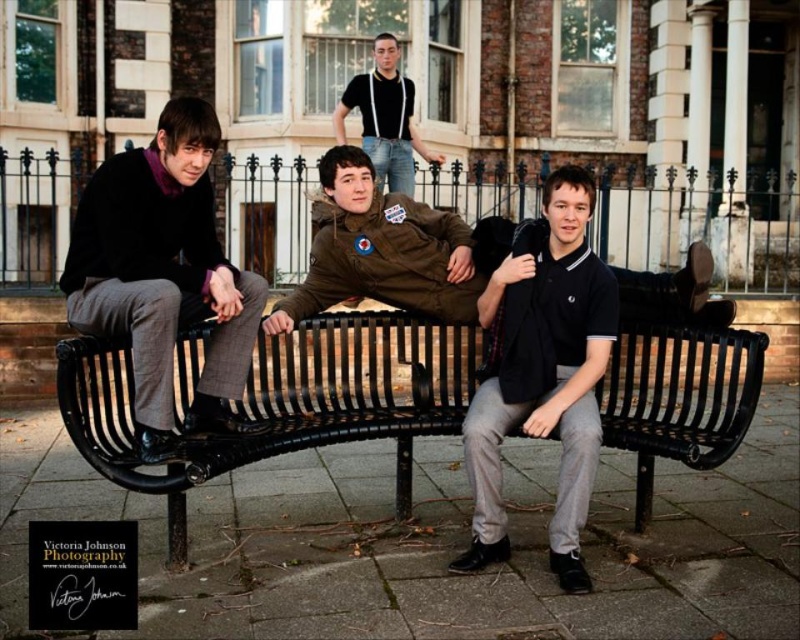
Consider the image. Can you confirm if black metal bench at center is positioned to the left of black cotton polo shirt at center?

Yes, black metal bench at center is to the left of black cotton polo shirt at center.

Who is lower down, black metal bench at center or black cotton polo shirt at center?

black cotton polo shirt at center

Does point (370, 394) come behind point (568, 488)?

Yes.

You are a GUI agent. You are given a task and a screenshot of the screen. Output one action in this format:
    pyautogui.click(x=<x>, y=<y>)
    Task: Click on the black metal bench at center
    
    Given the screenshot: What is the action you would take?
    pyautogui.click(x=285, y=397)

Is matte black sweater at left behind black cotton polo shirt at center?

Yes, it is.

Does matte black sweater at left have a lesser width compared to black cotton polo shirt at center?

Correct, matte black sweater at left's width is less than black cotton polo shirt at center's.

Locate an element on the screen. The image size is (800, 640). matte black sweater at left is located at coordinates (164, 275).

Can you confirm if matte black sweater at left is positioned to the right of matte black t-shirt at upper center?

Incorrect, matte black sweater at left is not on the right side of matte black t-shirt at upper center.

Is point (206, 365) more distant than point (354, 97)?

No.

Between point (172, 230) and point (356, 106), which one is positioned behind?

The point (356, 106) is more distant.

Locate an element on the screen. matte black sweater at left is located at coordinates [164, 275].